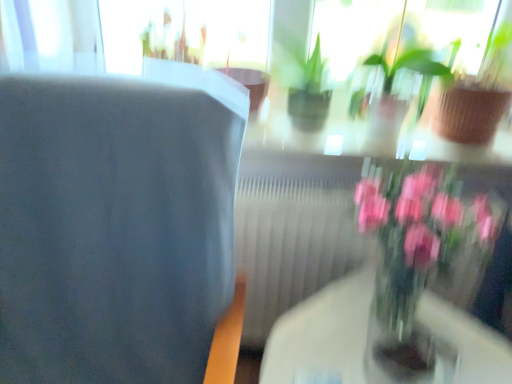
What is the approximate width of green glossy houseplant at upper center, the 1th houseplant positioned from the left?

25.91 centimeters.

This screenshot has height=384, width=512. I want to click on green glossy houseplant at upper center, the 1th houseplant positioned from the left, so click(406, 61).

Find the location of `pink glass vase at right`. pink glass vase at right is located at coordinates (x=416, y=262).

What do you see at coordinates (113, 229) in the screenshot?
I see `blue fabric chair at left` at bounding box center [113, 229].

Measure the distance between point (210, 24) and camera.

4.94 feet.

Measure the distance between clear glass vase at center and camera.

They are 95.58 centimeters apart.

Image resolution: width=512 pixels, height=384 pixels. Describe the element at coordinates (476, 97) in the screenshot. I see `green matte plant at upper right, which is counted as the first houseplant, starting from the right` at that location.

I want to click on green glossy houseplant at upper center, which is counted as the 2th houseplant, starting from the right, so click(x=406, y=61).

Does transparent glass door at upper center turn towards green glossy houseplant at upper center, which is counted as the 2th houseplant, starting from the right?

No, transparent glass door at upper center is not aimed at green glossy houseplant at upper center, which is counted as the 2th houseplant, starting from the right.

The image size is (512, 384). I want to click on glass door located above the green glossy houseplant at upper center, the 1th houseplant positioned from the left (from the image's perspective), so click(x=185, y=32).

From a real-world perspective, is transparent glass door at upper center positioned over green glossy houseplant at upper center, the 1th houseplant positioned from the left, based on gravity?

Yes.

Is the depth of transparent glass door at upper center greater than that of green glossy houseplant at upper center, which is counted as the 2th houseplant, starting from the right?

Yes, transparent glass door at upper center is further from the viewer.

From the image's perspective, would you say pink glass vase at right is positioned over clear glass vase at center?

Yes.

In terms of width, does pink glass vase at right look wider or thinner when compared to clear glass vase at center?

pink glass vase at right is thinner than clear glass vase at center.

From a real-world perspective, which object rests below the other?

clear glass vase at center, from a real-world perspective.

Is clear glass vase at center a part of pink glass vase at right?

Definitely not — clear glass vase at center is not inside pink glass vase at right.

Who is more distant, clear glass vase at center or green matte plant at upper right, which is the 2th houseplant from left to right?

green matte plant at upper right, which is the 2th houseplant from left to right, is more distant.

Are clear glass vase at center and green matte plant at upper right, which is the 2th houseplant from left to right, making contact?

clear glass vase at center is not next to green matte plant at upper right, which is the 2th houseplant from left to right, and they're not touching.

From a real-world perspective, which is physically above, clear glass vase at center or green matte plant at upper right, which is the 2th houseplant from left to right?

green matte plant at upper right, which is the 2th houseplant from left to right, is physically above.

Can you confirm if blue fabric chair at left is shorter than transparent glass door at upper center?

No, blue fabric chair at left is not shorter than transparent glass door at upper center.

Who is more distant, blue fabric chair at left or transparent glass door at upper center?

→ transparent glass door at upper center is more distant.

From a real-world perspective, which is physically below, blue fabric chair at left or transparent glass door at upper center?

blue fabric chair at left is physically lower.

Are blue fabric chair at left and transparent glass door at upper center making contact?

No, blue fabric chair at left is not in contact with transparent glass door at upper center.

Can you confirm if clear glass vase at center is thinner than transparent glass door at upper center?

No, clear glass vase at center is not thinner than transparent glass door at upper center.

Is clear glass vase at center aimed at transparent glass door at upper center?

No.

Between clear glass vase at center and transparent glass door at upper center, which one appears on the left side from the viewer's perspective?

From the viewer's perspective, transparent glass door at upper center appears more on the left side.

Where is `round table in front of the transparent glass door at upper center`? This screenshot has height=384, width=512. round table in front of the transparent glass door at upper center is located at coordinates (323, 333).

Are green glossy houseplant at upper center, the 1th houseplant positioned from the left, and clear glass vase at center beside each other?

No, green glossy houseplant at upper center, the 1th houseplant positioned from the left, is not touching clear glass vase at center.

Could you measure the distance between green glossy houseplant at upper center, which is counted as the 2th houseplant, starting from the right, and clear glass vase at center?

They are 24.56 inches apart.

From the image's perspective, would you say green glossy houseplant at upper center, the 1th houseplant positioned from the left, is shown under clear glass vase at center?

Incorrect, from the image's perspective, green glossy houseplant at upper center, the 1th houseplant positioned from the left, is higher than clear glass vase at center.

Which object is further away from the camera, green glossy houseplant at upper center, which is counted as the 2th houseplant, starting from the right, or clear glass vase at center?

green glossy houseplant at upper center, which is counted as the 2th houseplant, starting from the right, is behind.

Does green matte plant at upper right, which is counted as the first houseplant, starting from the right, have a smaller size compared to blue fabric chair at left?

Yes, green matte plant at upper right, which is counted as the first houseplant, starting from the right, is smaller than blue fabric chair at left.

Consider the image. Is blue fabric chair at left completely or partially inside green matte plant at upper right, which is the 2th houseplant from left to right?

No, green matte plant at upper right, which is the 2th houseplant from left to right, does not contain blue fabric chair at left.

Is green matte plant at upper right, which is the 2th houseplant from left to right, further to the viewer compared to blue fabric chair at left?

Yes, green matte plant at upper right, which is the 2th houseplant from left to right, is further from the camera.

Does green matte plant at upper right, which is counted as the first houseplant, starting from the right, have a greater width compared to blue fabric chair at left?

No, green matte plant at upper right, which is counted as the first houseplant, starting from the right, is not wider than blue fabric chair at left.

From the transparent glass door at upper center, count 1st houseplants forward and point to it. Please provide its 2D coordinates.

[(406, 61)]

At what (x,y) coordinates should I click in order to perform the action: click on floral arrangement above the clear glass vase at center (from a real-world perspective). Please return your answer as a coordinate pair (x, y). Looking at the image, I should click on (416, 262).

Estimate the real-world distances between objects in this image. Which object is further from green glossy houseplant at upper center, which is counted as the 2th houseplant, starting from the right, pink glass vase at right or green matte plant at upper right, which is counted as the first houseplant, starting from the right?

pink glass vase at right is positioned further to the anchor green glossy houseplant at upper center, which is counted as the 2th houseplant, starting from the right.

From the image, which object appears to be nearer to blue fabric chair at left, green glossy houseplant at upper center, which is counted as the 2th houseplant, starting from the right, or clear glass vase at center?

clear glass vase at center lies closer to blue fabric chair at left than the other object.

Considering their positions, is clear glass vase at center positioned further to blue fabric chair at left than pink glass vase at right?

pink glass vase at right is positioned further to the anchor blue fabric chair at left.

From the image, which object appears to be nearer to green glossy houseplant at upper center, the 1th houseplant positioned from the left, clear glass vase at center or pink glass vase at right?

pink glass vase at right.

Considering their positions, is pink glass vase at right positioned closer to green glossy houseplant at upper center, which is counted as the 2th houseplant, starting from the right, than transparent glass door at upper center?

pink glass vase at right is positioned closer to the anchor green glossy houseplant at upper center, which is counted as the 2th houseplant, starting from the right.

Estimate the real-world distances between objects in this image. Which object is further from blue fabric chair at left, green matte plant at upper right, which is the 2th houseplant from left to right, or clear glass vase at center?

The object further to blue fabric chair at left is green matte plant at upper right, which is the 2th houseplant from left to right.

Based on their spatial positions, is clear glass vase at center or green matte plant at upper right, which is the 2th houseplant from left to right, further from pink glass vase at right?

The object further to pink glass vase at right is green matte plant at upper right, which is the 2th houseplant from left to right.

Estimate the real-world distances between objects in this image. Which object is closer to transparent glass door at upper center, clear glass vase at center or green matte plant at upper right, which is counted as the first houseplant, starting from the right?

green matte plant at upper right, which is counted as the first houseplant, starting from the right, lies closer to transparent glass door at upper center than the other object.

You are a GUI agent. You are given a task and a screenshot of the screen. Output one action in this format:
    pyautogui.click(x=<x>, y=<y>)
    Task: Click on the floral arrangement between blue fabric chair at left and transparent glass door at upper center in the front-back direction
    Image resolution: width=512 pixels, height=384 pixels.
    Given the screenshot: What is the action you would take?
    pyautogui.click(x=416, y=262)

Locate an element on the screen. This screenshot has width=512, height=384. floral arrangement that lies between green matte plant at upper right, which is counted as the first houseplant, starting from the right, and clear glass vase at center from top to bottom is located at coordinates (416, 262).

I want to click on houseplant between green matte plant at upper right, which is the 2th houseplant from left to right, and pink glass vase at right, in the vertical direction, so click(x=406, y=61).

Locate an element on the screen. Image resolution: width=512 pixels, height=384 pixels. round table between blue fabric chair at left and pink glass vase at right from left to right is located at coordinates (323, 333).